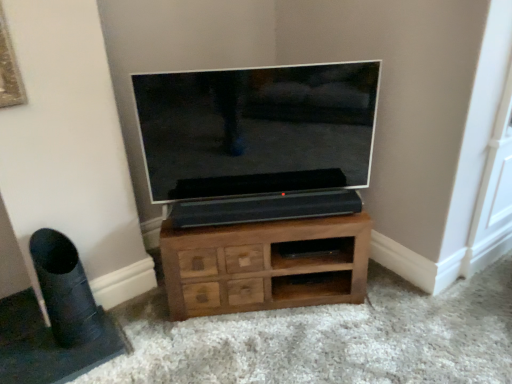
Find the location of a particular element. This screenshot has width=512, height=384. free point above flat screen tv at center (from a real-world perspective) is located at coordinates (247, 71).